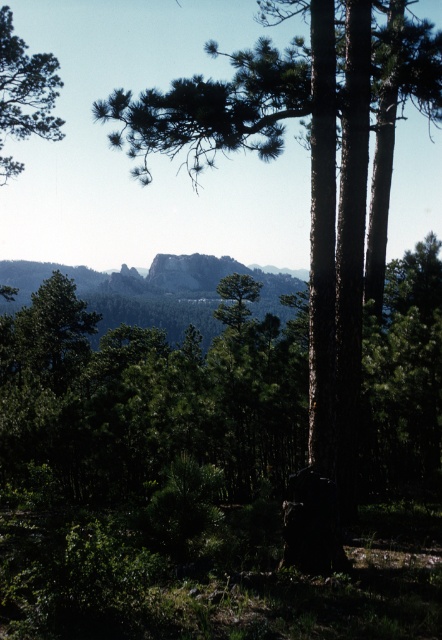
You are standing at the origin point in the forest. There is a green rough bark tree at center. Can you determine its position relative to your current location?

The green rough bark tree at center is located at point [311,202], so it is northeast of your current position at the origin.